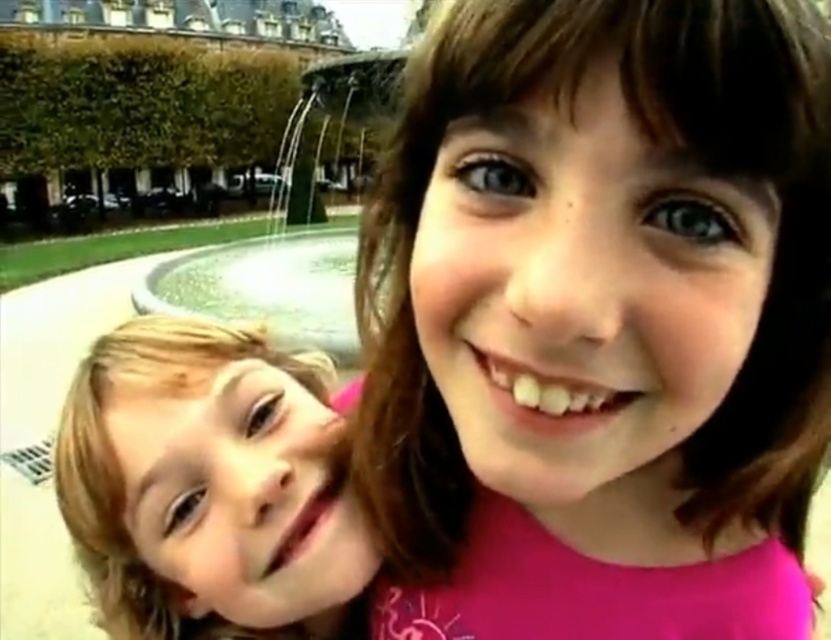
Question: Is pink fabric at center to the right of blonde hair at left from the viewer's perspective?

Choices:
 (A) yes
 (B) no

Answer: (A)

Question: Which point is farther from the camera taking this photo?

Choices:
 (A) (143, 339)
 (B) (638, 349)

Answer: (A)

Question: Observing the image, what is the correct spatial positioning of pink fabric at center in reference to blonde hair at left?

Choices:
 (A) left
 (B) right

Answer: (B)

Question: Is pink fabric at center wider than blonde hair at left?

Choices:
 (A) yes
 (B) no

Answer: (A)

Question: Which point is farther to the camera?

Choices:
 (A) (552, 493)
 (B) (107, 394)

Answer: (B)

Question: Which point is farther to the camera?

Choices:
 (A) (529, 156)
 (B) (279, 584)

Answer: (B)